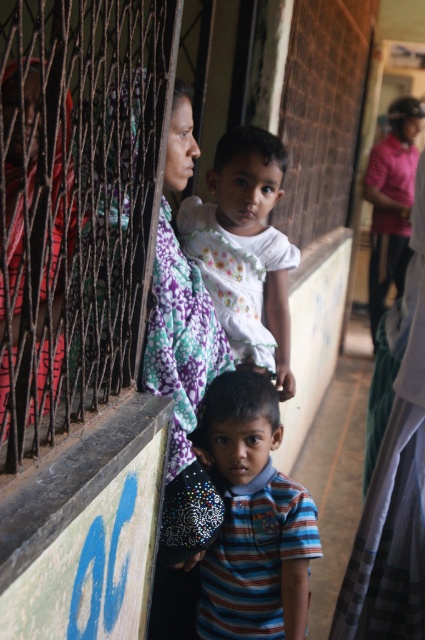
Question: Which point appears farthest from the camera in this image?

Choices:
 (A) (220, 417)
 (B) (266, 257)

Answer: (B)

Question: Considering the relative positions of striped cotton shirt at center and white matte dress at center in the image provided, where is striped cotton shirt at center located with respect to white matte dress at center?

Choices:
 (A) below
 (B) above

Answer: (A)

Question: Which of the following is the closest to the observer?

Choices:
 (A) (231, 237)
 (B) (303, 556)

Answer: (B)

Question: Which object is farther from the camera taking this photo?

Choices:
 (A) striped cotton shirt at center
 (B) white matte dress at center

Answer: (B)

Question: Observing the image, what is the correct spatial positioning of striped cotton shirt at center in reference to white matte dress at center?

Choices:
 (A) right
 (B) left

Answer: (A)

Question: Does striped cotton shirt at center lie in front of white matte dress at center?

Choices:
 (A) yes
 (B) no

Answer: (A)